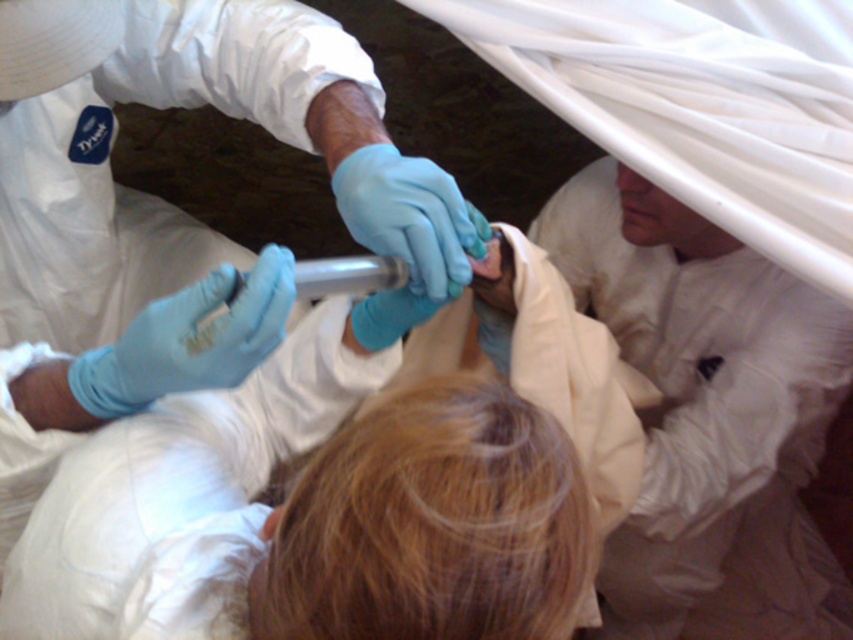
Question: Which object appears closest to the camera in this image?

Choices:
 (A) silver metallic syringe at center
 (B) white matte/soft fabric at upper right

Answer: (A)

Question: Which point is closer to the camera?

Choices:
 (A) (773, 456)
 (B) (378, 269)

Answer: (B)

Question: Can you confirm if white matte/soft fabric at upper right is thinner than silver metallic syringe at center?

Choices:
 (A) no
 (B) yes

Answer: (A)

Question: Does white matte/soft fabric at upper right have a greater width compared to silver metallic syringe at center?

Choices:
 (A) no
 (B) yes

Answer: (B)

Question: Does white matte/soft fabric at upper right lie behind silver metallic syringe at center?

Choices:
 (A) no
 (B) yes

Answer: (B)